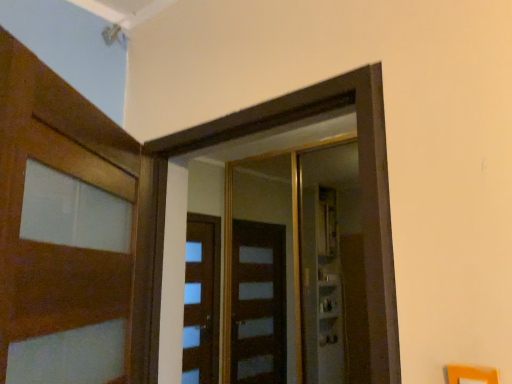
Question: In terms of height, does transparent glass elevator at center, the 2th elevator from the front, look taller or shorter compared to wooden door at center, placed as the 1th elevator when sorted from front to back?

Choices:
 (A) short
 (B) tall

Answer: (B)

Question: Relative to wooden door at center, placed as the 1th elevator when sorted from front to back, is transparent glass elevator at center, the 2th elevator from the front, in front or behind?

Choices:
 (A) behind
 (B) front

Answer: (A)

Question: Estimate the real-world distances between objects in this image. Which object is closer to the transparent glass elevator at center, the 1th elevator when ordered from back to front?

Choices:
 (A) wooden door at left
 (B) wooden door at center, placed as the 1th elevator when sorted from front to back

Answer: (B)

Question: Which is nearer to the wooden door at left?

Choices:
 (A) wooden door at center, placed as the 1th elevator when sorted from front to back
 (B) transparent glass elevator at center, the 2th elevator from the front

Answer: (A)